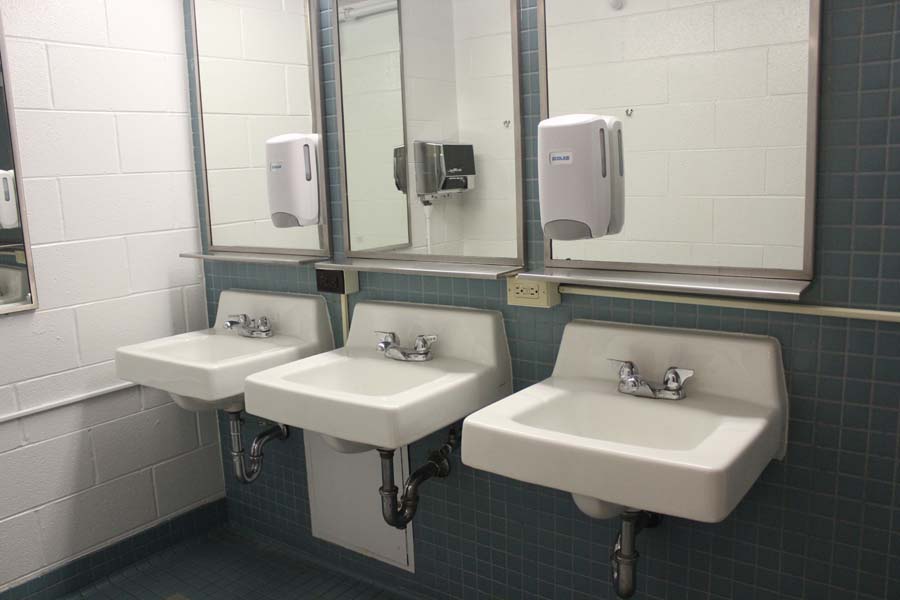
Find the location of a particular element. This screenshot has height=600, width=900. faucet is located at coordinates (630, 383), (383, 345), (239, 326).